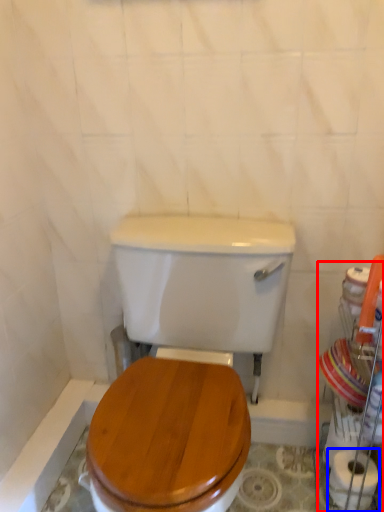
Question: Which object is closer to the camera taking this photo, porcelain (highlighted by a red box) or toilet paper (highlighted by a blue box)?

Choices:
 (A) porcelain
 (B) toilet paper

Answer: (A)